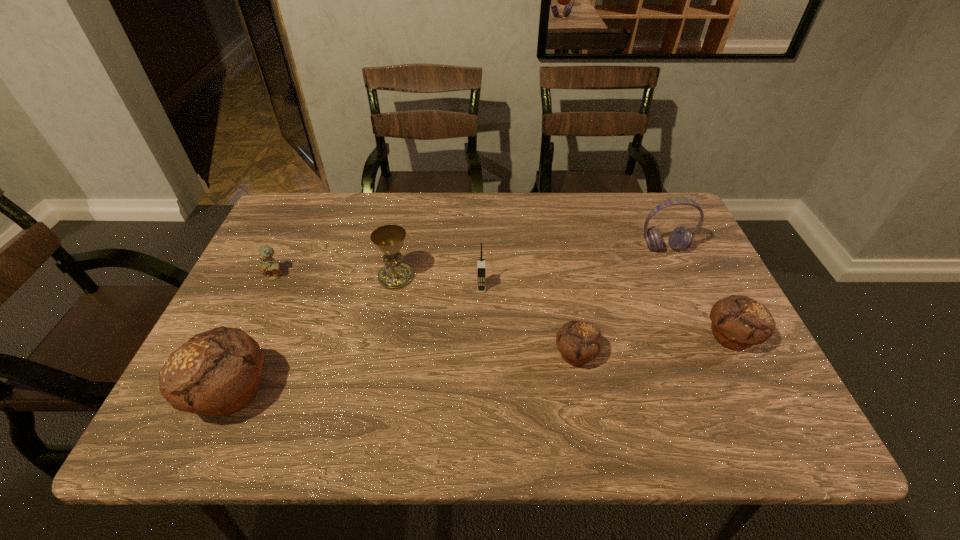
The height and width of the screenshot is (540, 960). Find the location of `the tallest muffin`. the tallest muffin is located at coordinates (216, 373).

At what (x,y) coordinates should I click in order to perform the action: click on the shortest muffin. Please return your answer as a coordinate pair (x, y). This screenshot has width=960, height=540. Looking at the image, I should click on (579, 342).

In order to click on the fifth object from left to right in this screenshot , I will do `click(579, 342)`.

This screenshot has width=960, height=540. In order to click on the second shortest muffin in this screenshot , I will do `click(738, 322)`.

At what (x,y) coordinates should I click in order to perform the action: click on teddy bear. Please return your answer as a coordinate pair (x, y). Image resolution: width=960 pixels, height=540 pixels. Looking at the image, I should click on (268, 266).

In order to click on chalice in this screenshot , I will do `click(389, 239)`.

This screenshot has width=960, height=540. In order to click on headset in this screenshot , I will do `click(681, 238)`.

The image size is (960, 540). I want to click on the fourth object from left to right, so click(481, 263).

Image resolution: width=960 pixels, height=540 pixels. Find the location of `vacant space located 0.390m on the back of the tallest muffin`. vacant space located 0.390m on the back of the tallest muffin is located at coordinates (298, 244).

Where is `free space located 0.270m on the left of the second muffin from right to left`? Image resolution: width=960 pixels, height=540 pixels. free space located 0.270m on the left of the second muffin from right to left is located at coordinates (433, 354).